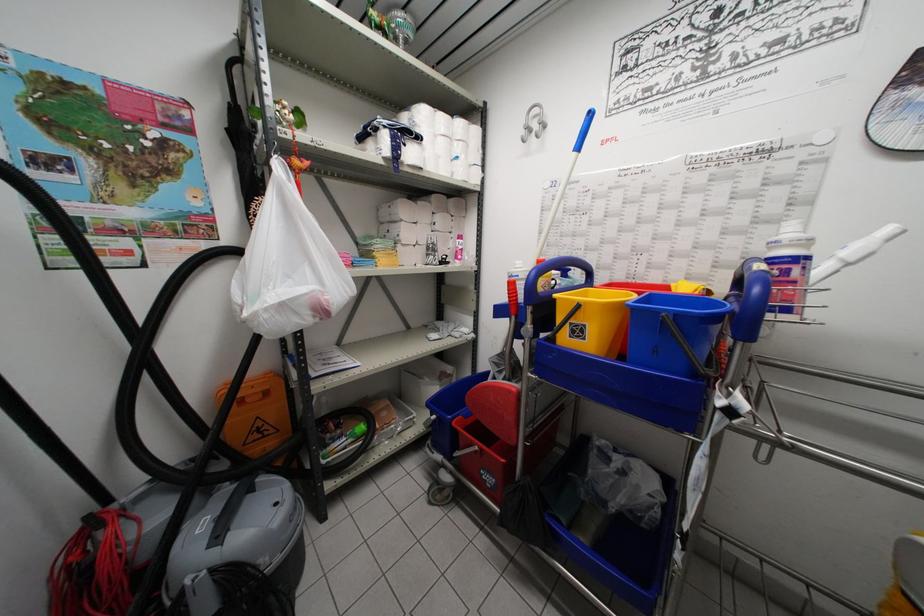
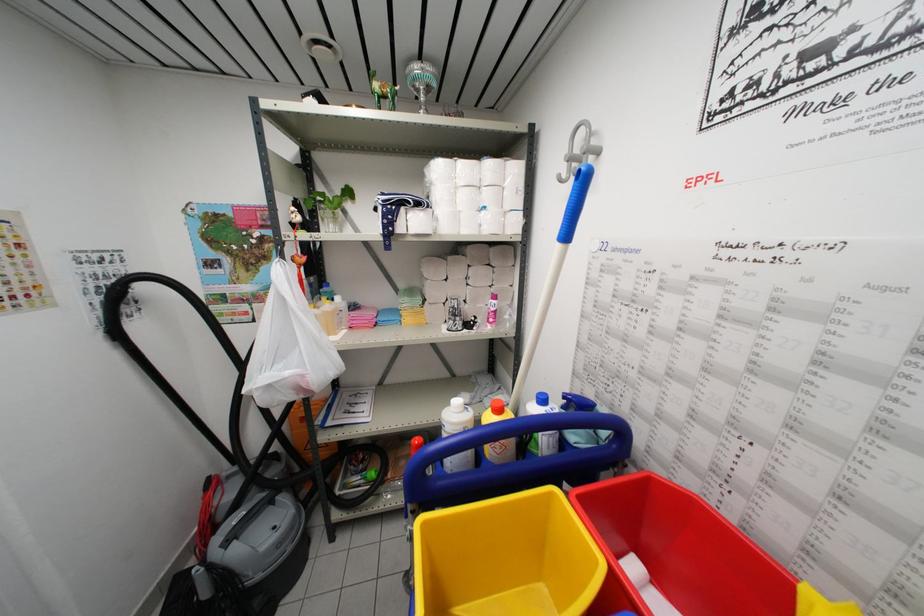
In the second image, find the point that corresponds to the point at 546,124 in the first image.

(597, 148)